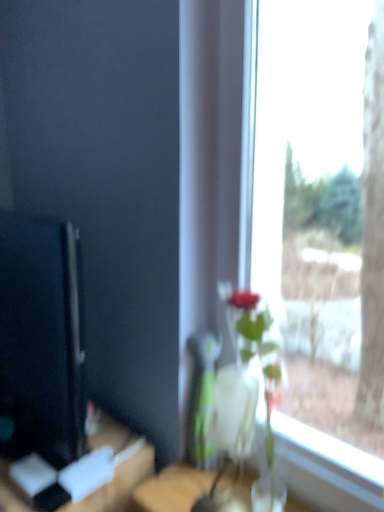
Question: Is black glossy computer monitor at left further to the viewer compared to wooden table at lower left?

Choices:
 (A) yes
 (B) no

Answer: (B)

Question: Could you tell me if black glossy computer monitor at left is turned towards wooden table at lower left?

Choices:
 (A) no
 (B) yes

Answer: (A)

Question: From a real-world perspective, is black glossy computer monitor at left located beneath wooden table at lower left?

Choices:
 (A) no
 (B) yes

Answer: (A)

Question: Can you confirm if black glossy computer monitor at left is positioned to the left of wooden table at lower left?

Choices:
 (A) yes
 (B) no

Answer: (B)

Question: From the image's perspective, is black glossy computer monitor at left located above wooden table at lower left?

Choices:
 (A) no
 (B) yes

Answer: (B)

Question: Is black glossy computer monitor at left with wooden table at lower left?

Choices:
 (A) no
 (B) yes

Answer: (A)

Question: Is black glossy computer monitor at left positioned behind clear glass vase at center?

Choices:
 (A) yes
 (B) no

Answer: (B)

Question: From the image's perspective, does black glossy computer monitor at left appear higher than clear glass vase at center?

Choices:
 (A) yes
 (B) no

Answer: (A)

Question: Considering the relative sizes of black glossy computer monitor at left and clear glass vase at center in the image provided, is black glossy computer monitor at left smaller than clear glass vase at center?

Choices:
 (A) no
 (B) yes

Answer: (A)

Question: Is black glossy computer monitor at left shorter than clear glass vase at center?

Choices:
 (A) yes
 (B) no

Answer: (B)

Question: From a real-world perspective, is black glossy computer monitor at left positioned over clear glass vase at center based on gravity?

Choices:
 (A) yes
 (B) no

Answer: (A)

Question: Can you confirm if black glossy computer monitor at left is bigger than clear glass vase at center?

Choices:
 (A) yes
 (B) no

Answer: (A)

Question: From a real-world perspective, is wooden table at lower left physically above black glossy computer monitor at left?

Choices:
 (A) no
 (B) yes

Answer: (A)